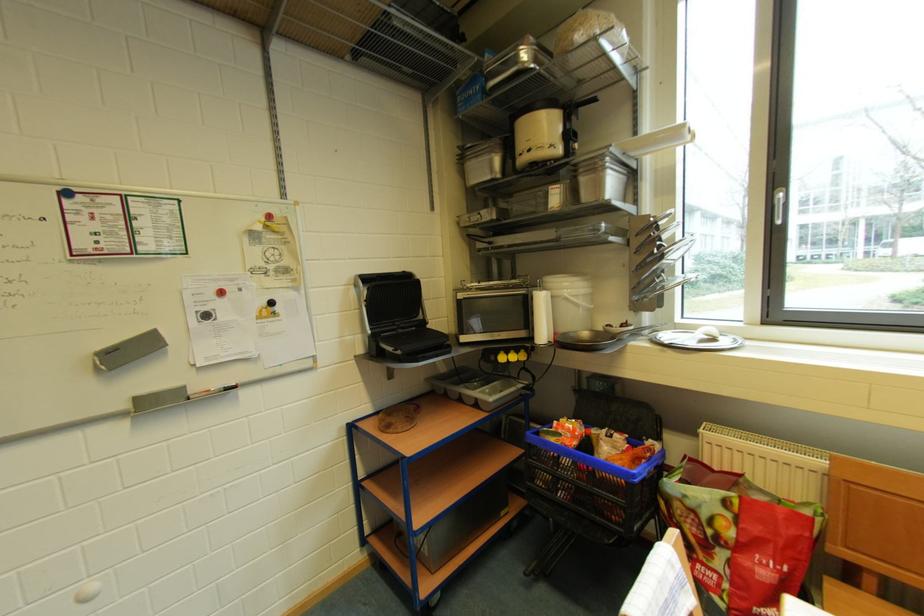
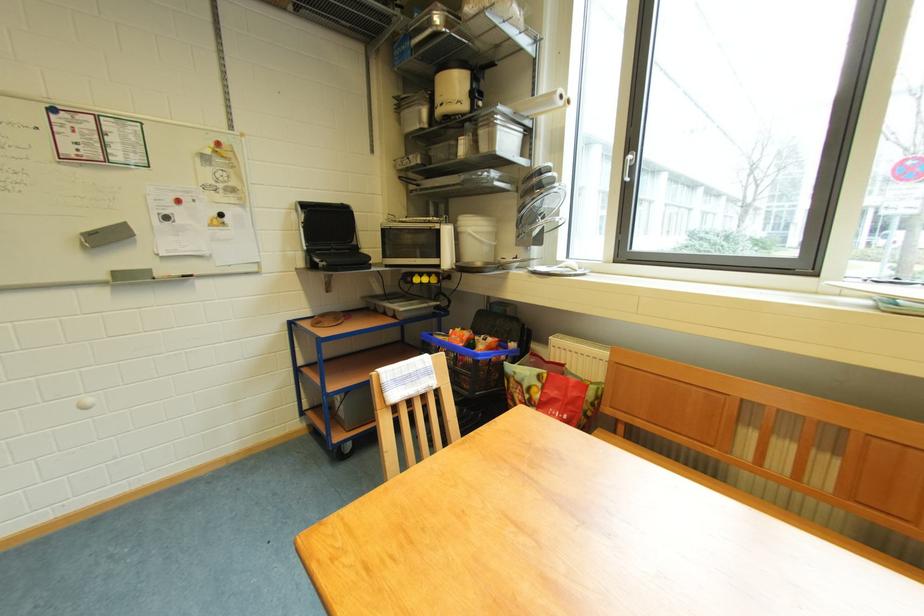
Find the pixel in the second image that matches (x=589, y=174) in the first image.

(488, 127)